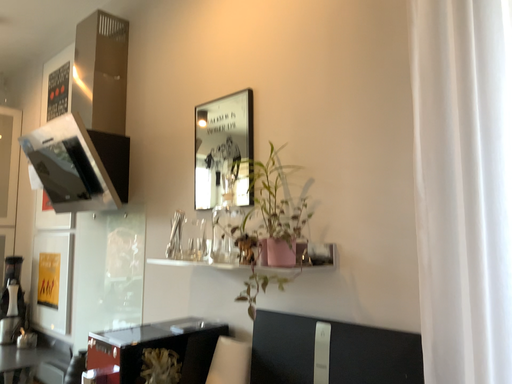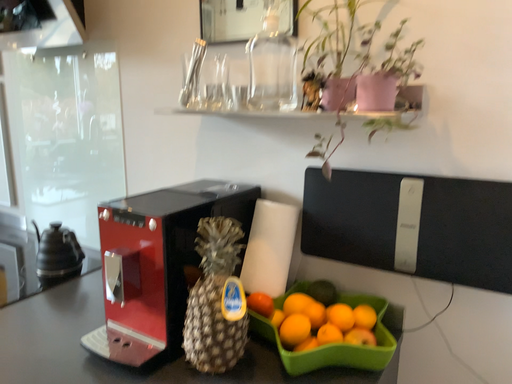
Question: Which way did the camera rotate in the video?

Choices:
 (A) rotated right
 (B) rotated left

Answer: (A)